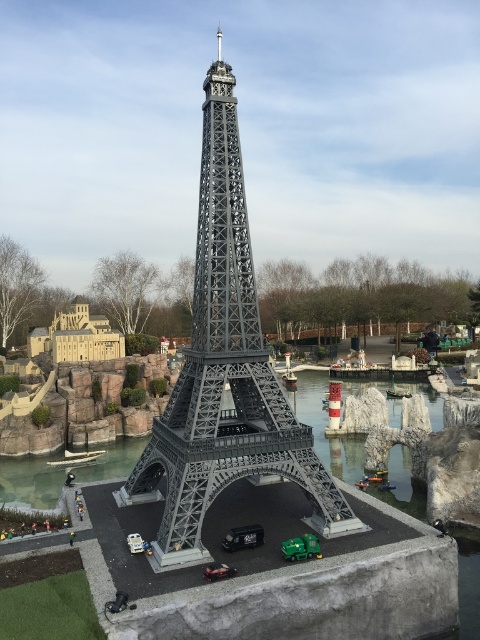
You are a toy collector who wants to place both the metallic gray eiffel tower at center and the green plastic car at center on a shelf. The shelf has a width of 50 cm. Can you fit both items side by side without overlapping?

The metallic gray eiffel tower at center might be wider than green plastic car at center, so it is uncertain if they can fit side by side on a 50 cm shelf without overlapping. Measure both items to confirm their combined width.

You are standing at the coordinates 0,0 and want to walk towards the metallic gray eiffel tower at center. Which direction should you head?

Since the metallic gray eiffel tower at center is located at coordinates (225, 371), you should head towards the northeast direction to reach it.